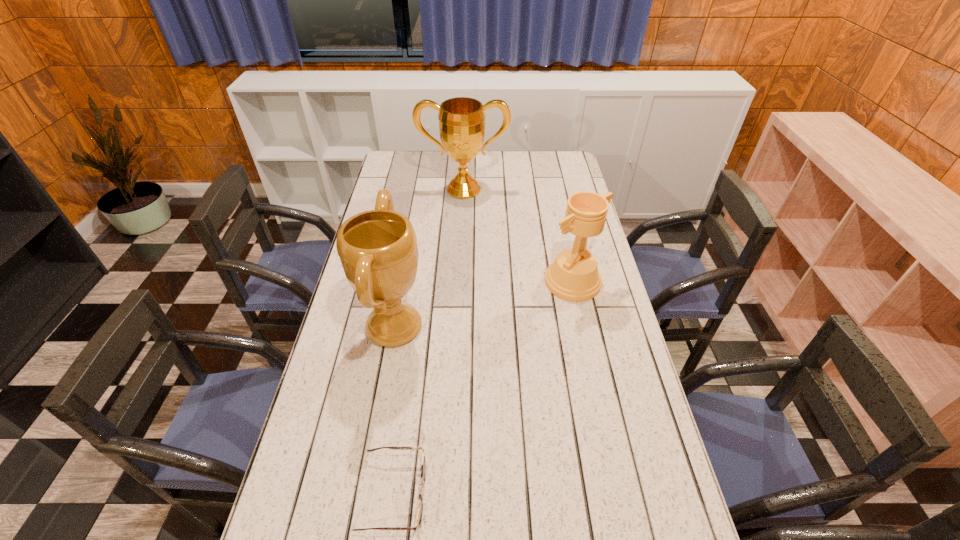
The image size is (960, 540). In the image, there is a desktop. In order to click on vacant region at the far edge in this screenshot , I will do `click(522, 157)`.

This screenshot has width=960, height=540. In the image, there is a desktop. In order to click on vacant area at the left edge in this screenshot , I will do `click(338, 346)`.

At what (x,y) coordinates should I click in order to perform the action: click on free space at the right edge of the desktop. Please return your answer as a coordinate pair (x, y). Looking at the image, I should click on (604, 406).

The image size is (960, 540). What are the coordinates of `vacant space at the far left corner` in the screenshot? It's located at (390, 163).

The height and width of the screenshot is (540, 960). In order to click on vacant region at the far right corner in this screenshot , I will do `click(543, 174)`.

Find the location of a particular element. The height and width of the screenshot is (540, 960). free area in between the shortest award and the farthest award is located at coordinates (518, 235).

Where is `free space between the farthest object and the spectacles`? free space between the farthest object and the spectacles is located at coordinates (429, 342).

This screenshot has height=540, width=960. I want to click on free spot between the spectacles and the third tallest object, so click(483, 388).

Image resolution: width=960 pixels, height=540 pixels. I want to click on free spot between the farthest object and the shortest award, so click(518, 235).

Locate which object is the closest to the farthest object. Please provide its 2D coordinates. Your answer should be formatted as a tuple, i.e. [(x, y)], where the tuple contains the x and y coordinates of a point satisfying the conditions above.

[(573, 276)]